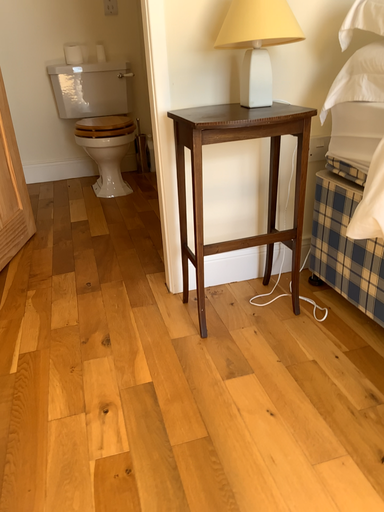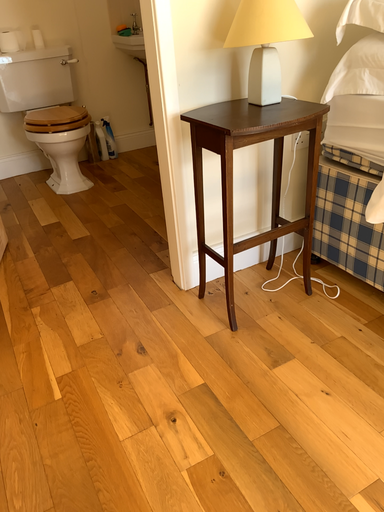
Question: How did the camera likely rotate when shooting the video?

Choices:
 (A) rotated left
 (B) rotated right

Answer: (B)